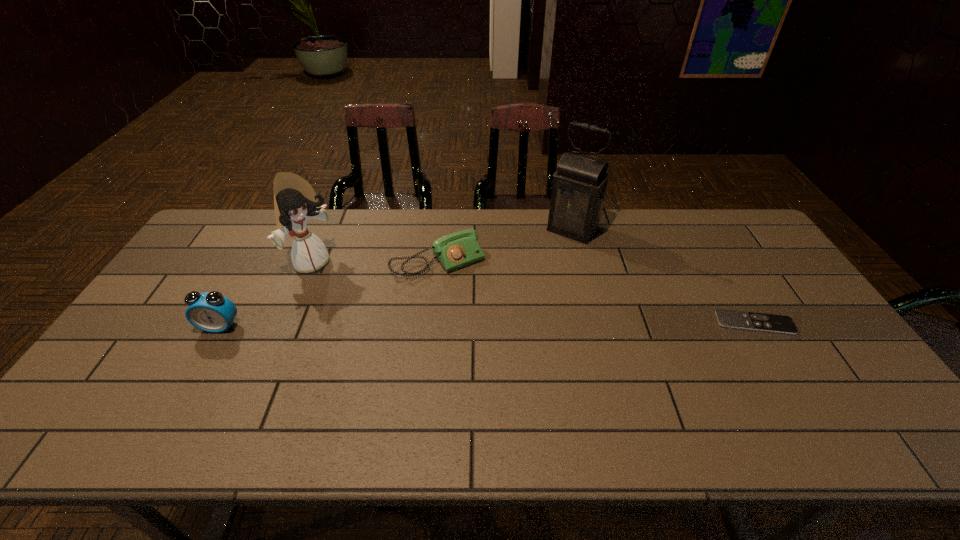
Where is `the third tallest object`? This screenshot has width=960, height=540. the third tallest object is located at coordinates (212, 312).

Where is `alarm clock`? alarm clock is located at coordinates (212, 312).

The width and height of the screenshot is (960, 540). In order to click on remote control in this screenshot , I will do `click(773, 323)`.

The height and width of the screenshot is (540, 960). I want to click on the shortest object, so click(x=773, y=323).

This screenshot has height=540, width=960. Identify the location of the fourth object from left to right. (578, 194).

In order to click on the tallest object in this screenshot , I will do `click(578, 194)`.

The image size is (960, 540). In order to click on the third object from left to right in this screenshot , I will do `click(454, 251)`.

Find the location of `telephone`. telephone is located at coordinates (454, 251).

The width and height of the screenshot is (960, 540). I want to click on the fourth object from right to left, so click(295, 201).

Where is `doll`? doll is located at coordinates (295, 201).